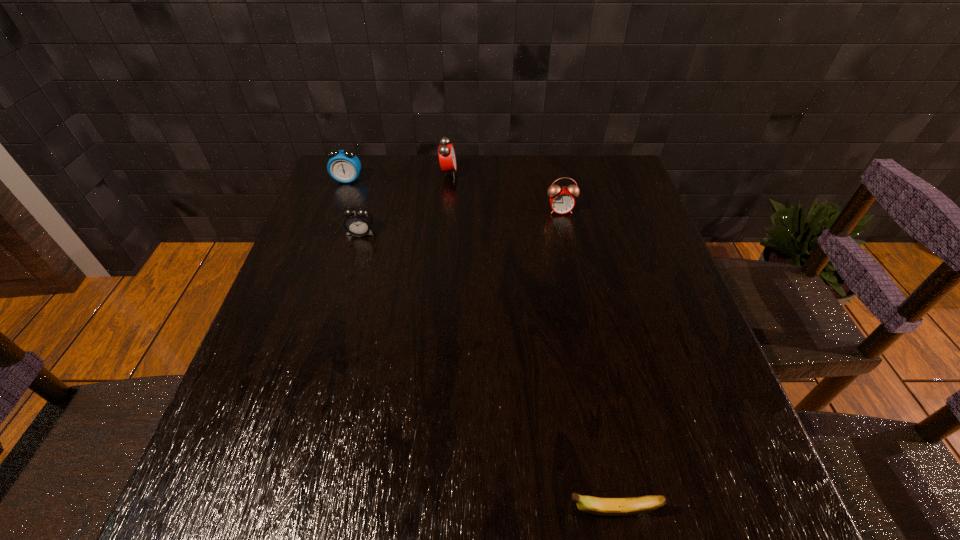
I want to click on the third alarm clock from left to right, so click(447, 158).

You are a GUI agent. You are given a task and a screenshot of the screen. Output one action in this format:
    pyautogui.click(x=<x>, y=<y>)
    Task: Click on the second nearest alarm clock
    This screenshot has height=540, width=960.
    Given the screenshot: What is the action you would take?
    pyautogui.click(x=562, y=201)

Locate an element on the screen. Image resolution: width=960 pixels, height=540 pixels. the third farthest object is located at coordinates (562, 201).

You are a GUI agent. You are given a task and a screenshot of the screen. Output one action in this format:
    pyautogui.click(x=<x>, y=<y>)
    Task: Click on the leftmost alarm clock
    
    Given the screenshot: What is the action you would take?
    pyautogui.click(x=344, y=166)

Image resolution: width=960 pixels, height=540 pixels. What are the coordinates of `the fourth farthest object` in the screenshot? It's located at (358, 220).

Locate an element on the screen. the shortest alarm clock is located at coordinates (358, 220).

This screenshot has width=960, height=540. I want to click on the nearest object, so click(599, 506).

Locate an element on the screen. vacant area located on the front-facing side of the second alarm clock from right to left is located at coordinates (544, 173).

This screenshot has width=960, height=540. Find the location of `vacant space positioned 0.130m on the clock face of the second nearest alarm clock`. vacant space positioned 0.130m on the clock face of the second nearest alarm clock is located at coordinates (568, 247).

This screenshot has width=960, height=540. Identify the location of free location located 0.280m on the face of the leftmost object. (323, 247).